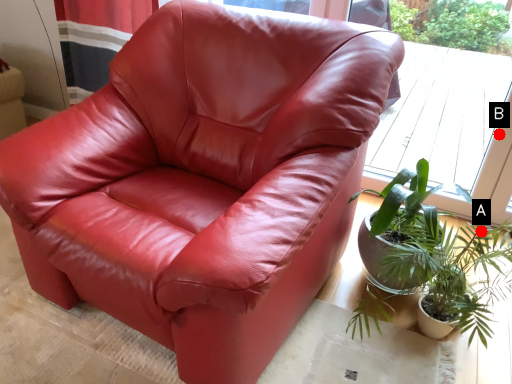
Question: Two points are circled on the image, labeled by A and B beside each circle. Which of the following is the closest to the observer?

Choices:
 (A) A is closer
 (B) B is closer

Answer: (A)